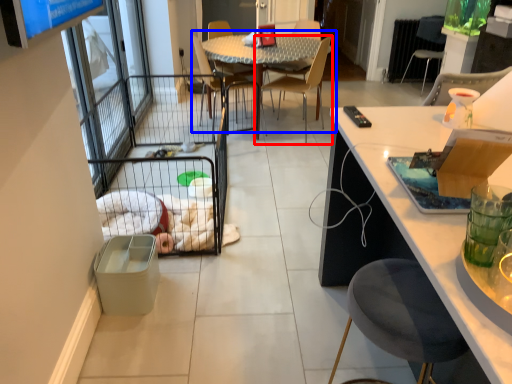
Question: Which of the following is the farthest to the observer, chair (highlighted by a red box) or kitchen & dining room table (highlighted by a blue box)?

Choices:
 (A) chair
 (B) kitchen & dining room table

Answer: (B)